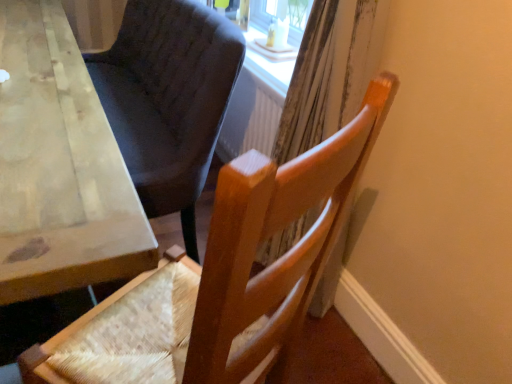
Question: From a real-world perspective, is wooden chair at center above or below wooden curtain at right?

Choices:
 (A) above
 (B) below

Answer: (B)

Question: From the image's perspective, relative to wooden curtain at right, is wooden chair at center above or below?

Choices:
 (A) above
 (B) below

Answer: (B)

Question: Which is nearer to the wooden curtain at right?

Choices:
 (A) wooden table at left
 (B) wooden chair at center

Answer: (B)

Question: Estimate the real-world distances between objects in this image. Which object is farther from the wooden curtain at right?

Choices:
 (A) wooden chair at center
 (B) wooden table at left

Answer: (B)